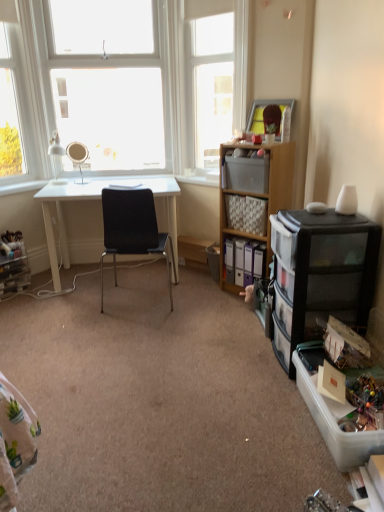
Question: Is clear plastic storage box at lower right, marked as the 2th storage box in a top-to-bottom arrangement, outside white glossy desk at center?

Choices:
 (A) no
 (B) yes

Answer: (B)

Question: From the image's perspective, is clear plastic storage box at lower right, marked as the 2th storage box in a back-to-front arrangement, located beneath white glossy desk at center?

Choices:
 (A) yes
 (B) no

Answer: (A)

Question: Can you confirm if clear plastic storage box at lower right, acting as the first storage box starting from the front, is bigger than white glossy desk at center?

Choices:
 (A) no
 (B) yes

Answer: (A)

Question: Is clear plastic storage box at lower right, acting as the first storage box starting from the front, at the right side of white glossy desk at center?

Choices:
 (A) yes
 (B) no

Answer: (A)

Question: From a real-world perspective, is clear plastic storage box at lower right, acting as the first storage box starting from the front, physically above white glossy desk at center?

Choices:
 (A) no
 (B) yes

Answer: (A)

Question: Is clear plastic storage box at lower right, marked as the 2th storage box in a back-to-front arrangement, beside white glossy desk at center?

Choices:
 (A) no
 (B) yes

Answer: (A)

Question: Considering the relative sizes of matte silver mirror at upper left and black mesh chair at center in the image provided, is matte silver mirror at upper left smaller than black mesh chair at center?

Choices:
 (A) no
 (B) yes

Answer: (B)

Question: Can you confirm if matte silver mirror at upper left is positioned to the left of black mesh chair at center?

Choices:
 (A) yes
 (B) no

Answer: (A)

Question: Does matte silver mirror at upper left have a lesser width compared to black mesh chair at center?

Choices:
 (A) no
 (B) yes

Answer: (B)

Question: From a real-world perspective, is matte silver mirror at upper left located beneath black mesh chair at center?

Choices:
 (A) no
 (B) yes

Answer: (A)

Question: From the image's perspective, would you say matte silver mirror at upper left is shown under black mesh chair at center?

Choices:
 (A) no
 (B) yes

Answer: (A)

Question: Is matte silver mirror at upper left touching black mesh chair at center?

Choices:
 (A) yes
 (B) no

Answer: (B)

Question: Does clear plastic storage box at lower right, marked as the 2th storage box in a back-to-front arrangement, contain white plastic window sill at center?

Choices:
 (A) no
 (B) yes

Answer: (A)